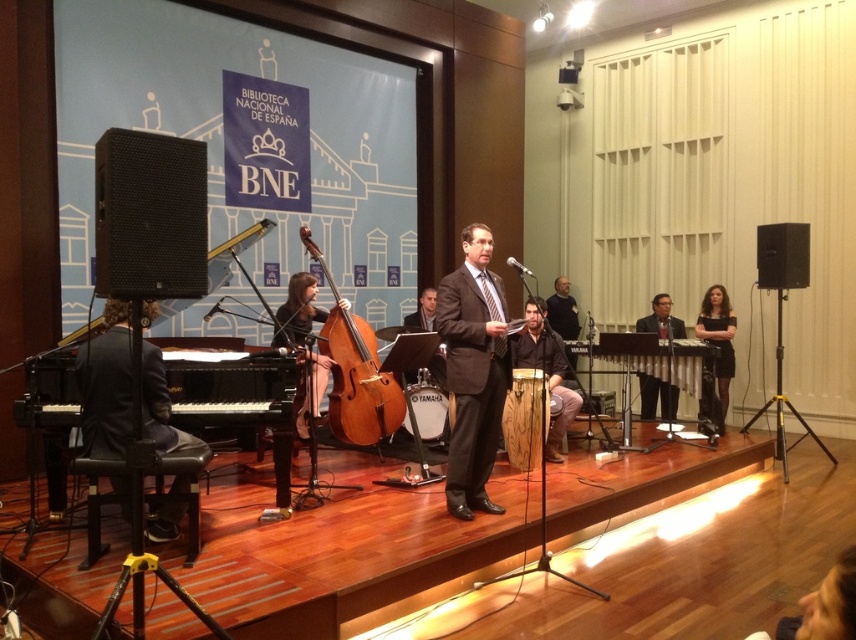
You are a photographer positioned at the back of the stage. You want to capture a closeup shot of the brown wooden cello at center and the matte brown wooden chair at center in the same frame. Which object should you focus on first to ensure both are in focus?

You should focus on the brown wooden cello at center first since it is closer to the viewer than the matte brown wooden chair at center, so adjusting the focus from the cello to the chair will help both be in focus.

You are an event photographer positioned at the back of the venue. You want to capture a clear shot of the matte black suit at center without the wooden drum at center blocking the view. Is this possible given their positions?

The wooden drum at center is closer to the viewer than the matte black suit at center, so the drum would block the view of the suit. You cannot capture a clear shot of the matte black suit at center without moving your position.